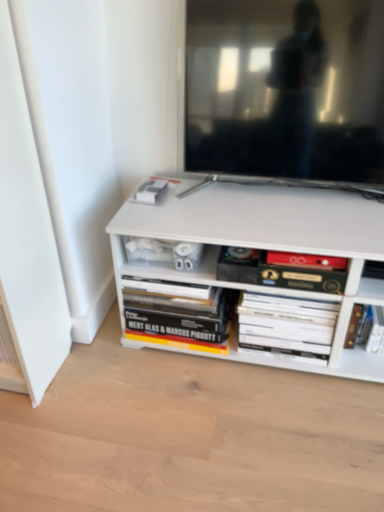
Locate an element on the screen. free space in front of white matte book at center, which is the 2th book from right to left is located at coordinates (276, 391).